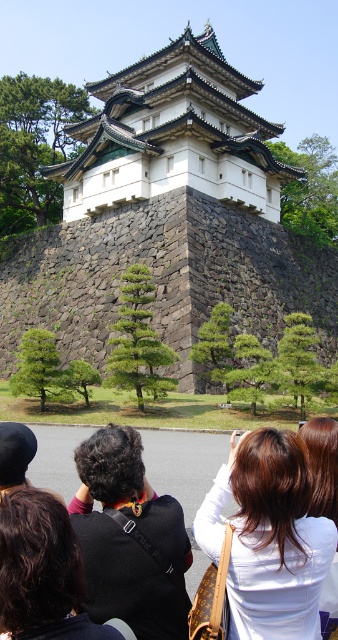
You are standing in front of the traditional Japanese castle. There is a point marked at coordinates (x=167, y=218). What does this point indicate?

The point at coordinates (x=167, y=218) indicates the stone and brick palace located at the center of the scene.

You are standing in front of the traditional Japanese castle and want to take a photo of the white stone building at center. However, there is a black fabric at lower left in your way. Can you still take the photo without moving the fabric?

The white stone building at center is further to the viewer than the black fabric at lower left, so the black fabric at lower left is between you and the white stone building at center. Therefore, you cannot take the photo without moving the black fabric at lower left.